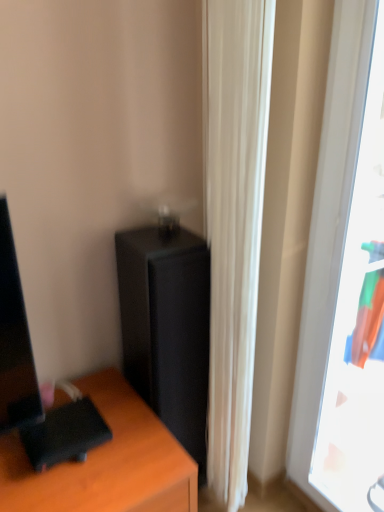
Question: Considering the relative sizes of transparent plastic window at right and black matte/file cabinet at center in the image provided, is transparent plastic window at right taller than black matte/file cabinet at center?

Choices:
 (A) yes
 (B) no

Answer: (A)

Question: Is transparent plastic window at right to the left of black matte/file cabinet at center from the viewer's perspective?

Choices:
 (A) no
 (B) yes

Answer: (A)

Question: Considering the relative sizes of transparent plastic window at right and black matte/file cabinet at center in the image provided, is transparent plastic window at right wider than black matte/file cabinet at center?

Choices:
 (A) yes
 (B) no

Answer: (B)

Question: Does transparent plastic window at right contain black matte/file cabinet at center?

Choices:
 (A) no
 (B) yes

Answer: (A)

Question: Is transparent plastic window at right next to black matte/file cabinet at center and touching it?

Choices:
 (A) no
 (B) yes

Answer: (A)

Question: Relative to white fabric curtain at center, is transparent plastic window at right in front or behind?

Choices:
 (A) behind
 (B) front

Answer: (B)

Question: Considering the relative positions of transparent plastic window at right and white fabric curtain at center in the image provided, is transparent plastic window at right to the left or to the right of white fabric curtain at center?

Choices:
 (A) left
 (B) right

Answer: (B)

Question: Does point (309, 291) appear closer or farther from the camera than point (243, 286)?

Choices:
 (A) closer
 (B) farther

Answer: (B)

Question: From a real-world perspective, is transparent plastic window at right physically located above or below white fabric curtain at center?

Choices:
 (A) below
 (B) above

Answer: (B)

Question: Does point (142, 265) appear closer or farther from the camera than point (296, 456)?

Choices:
 (A) farther
 (B) closer

Answer: (B)

Question: From a real-world perspective, is black matte/file cabinet at center above or below transparent plastic window at right?

Choices:
 (A) below
 (B) above

Answer: (A)

Question: In terms of size, does black matte/file cabinet at center appear bigger or smaller than transparent plastic window at right?

Choices:
 (A) small
 (B) big

Answer: (B)

Question: Based on their positions, is black matte/file cabinet at center located to the left or right of transparent plastic window at right?

Choices:
 (A) right
 (B) left

Answer: (B)

Question: Based on their positions, is white fabric curtain at center located to the left or right of transparent plastic window at right?

Choices:
 (A) left
 (B) right

Answer: (A)

Question: Is white fabric curtain at center wider or thinner than transparent plastic window at right?

Choices:
 (A) wide
 (B) thin

Answer: (B)